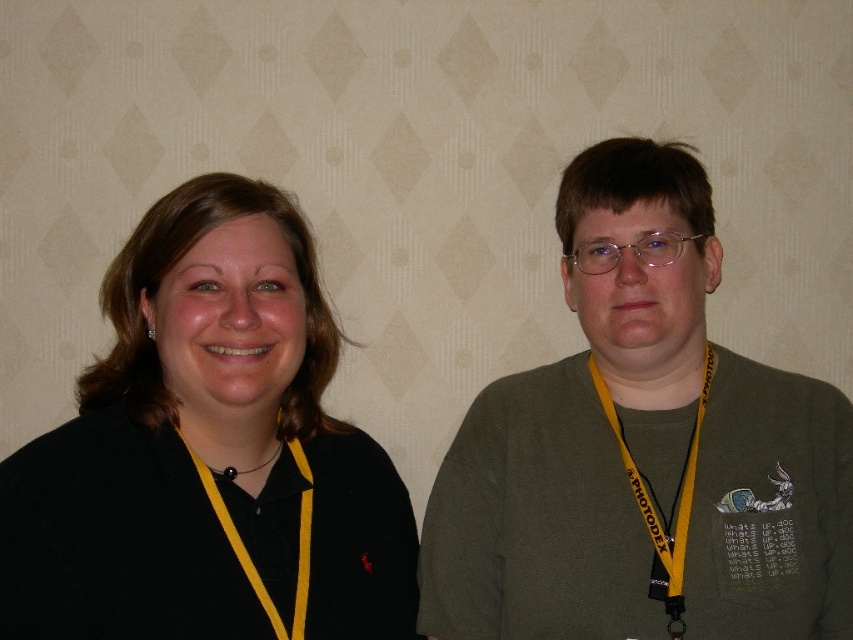
You are standing in front of the two people in the image. Which of the two points, point (287,305) or point (650,344), is closer to you?

Point (287,305) is in front of point (650,344), so it is closer to you.

Consider the image. You are a photographer setting up for a group photo. You have two subjects wearing the matte green sweater at right and the black matte shirt at left. You need to arrange them so that the taller subject stands behind the shorter one. Which subject should be placed in the back?

The matte green sweater at right is taller than the black matte shirt at left, so the matte green sweater at right should be placed in the back.

Looking at this image, you are standing in a conference room and see the matte green sweater at right. If you want to take a photo of it with your phone, which is 0.5 feet in length, will the sweater fit entirely in the frame if you hold your phone at eye level?

The matte green sweater at right is 3.42 feet away from the camera. Since the sweater is 3.42 feet away and your phone is 0.5 feet long, the sweater will likely fit entirely in the frame as the distance allows the entire sweater to be captured within the phone camera view.